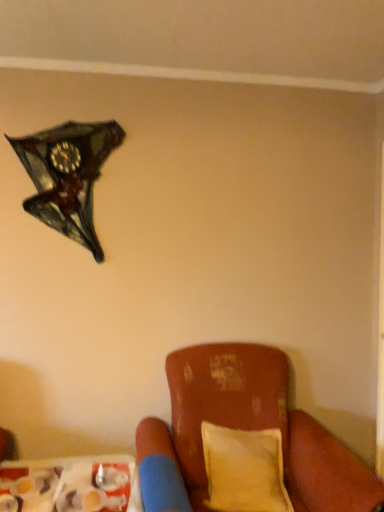
Question: Is yellow fabric pillow at lower right at the back of shiny glass clock at upper left?

Choices:
 (A) no
 (B) yes

Answer: (A)

Question: Can yellow fabric pillow at lower right be found inside shiny glass clock at upper left?

Choices:
 (A) yes
 (B) no

Answer: (B)

Question: Does shiny glass clock at upper left have a greater height compared to yellow fabric pillow at lower right?

Choices:
 (A) yes
 (B) no

Answer: (A)

Question: Considering the relative positions of shiny glass clock at upper left and yellow fabric pillow at lower right in the image provided, is shiny glass clock at upper left to the right of yellow fabric pillow at lower right from the viewer's perspective?

Choices:
 (A) no
 (B) yes

Answer: (A)

Question: Would you say shiny glass clock at upper left is outside yellow fabric pillow at lower right?

Choices:
 (A) yes
 (B) no

Answer: (A)

Question: From the image's perspective, would you say shiny glass clock at upper left is shown under yellow fabric pillow at lower right?

Choices:
 (A) no
 (B) yes

Answer: (A)

Question: Is shiny glass clock at upper left further to camera compared to leather cushion at lower right?

Choices:
 (A) no
 (B) yes

Answer: (B)

Question: Does shiny glass clock at upper left turn towards leather cushion at lower right?

Choices:
 (A) yes
 (B) no

Answer: (B)

Question: Does shiny glass clock at upper left lie in front of leather cushion at lower right?

Choices:
 (A) no
 (B) yes

Answer: (A)

Question: Can you confirm if shiny glass clock at upper left is positioned to the right of leather cushion at lower right?

Choices:
 (A) no
 (B) yes

Answer: (A)

Question: Is shiny glass clock at upper left to the left of leather cushion at lower right from the viewer's perspective?

Choices:
 (A) yes
 (B) no

Answer: (A)

Question: Can we say shiny glass clock at upper left lies outside leather cushion at lower right?

Choices:
 (A) yes
 (B) no

Answer: (A)

Question: Considering the relative sizes of plastic tray at lower left and leather cushion at lower right in the image provided, is plastic tray at lower left smaller than leather cushion at lower right?

Choices:
 (A) no
 (B) yes

Answer: (B)